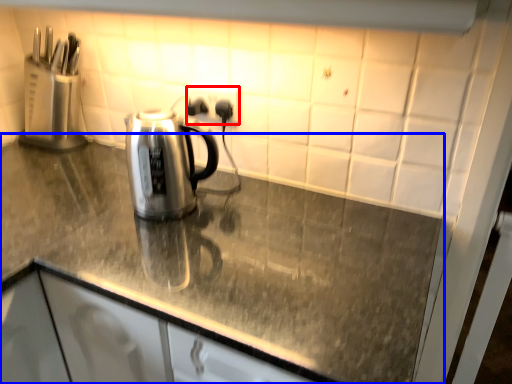
Question: Which object is further to the camera taking this photo, electric outlet (highlighted by a red box) or countertop (highlighted by a blue box)?

Choices:
 (A) electric outlet
 (B) countertop

Answer: (A)